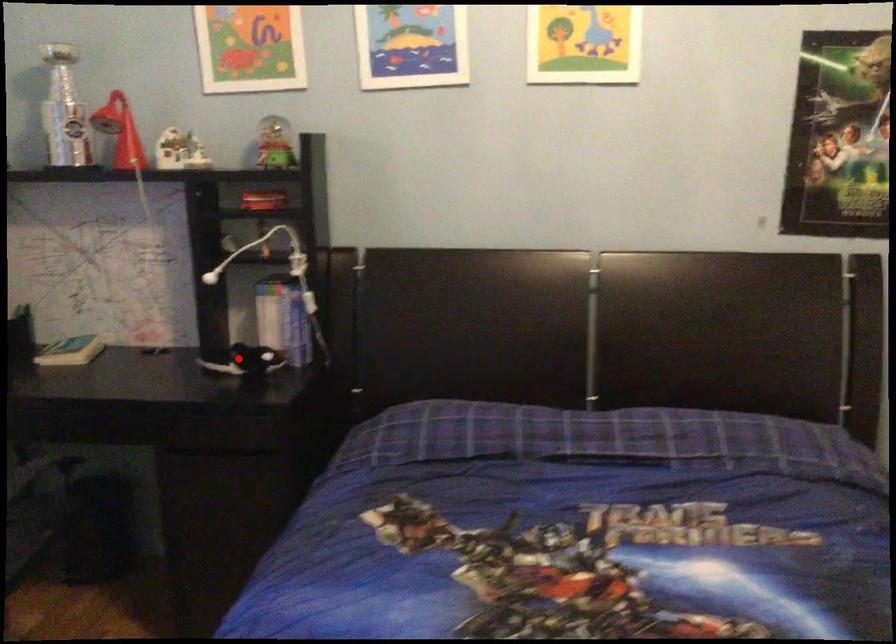
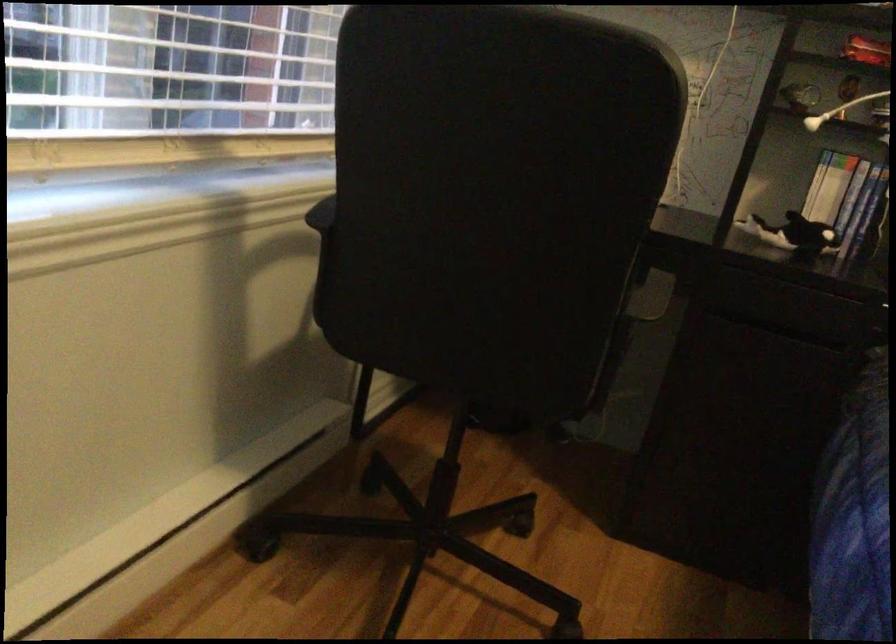
Question: I am providing you with two images of the same scene from different viewpoints. Given a red point in image1, look at the same physical point in image2. Is it:

Choices:
 (A) Closer to the viewpoint
 (B) Farther from the viewpoint

Answer: (A)